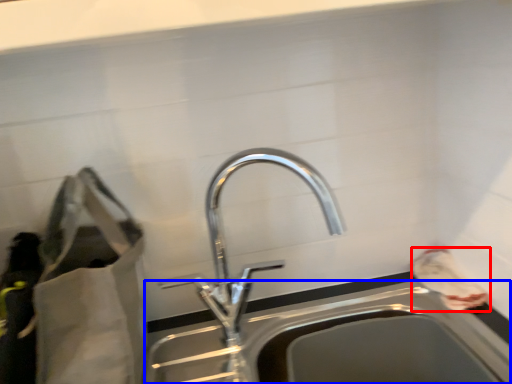
Question: Among these objects, which one is nearest to the camera, bag (highlighted by a red box) or sink (highlighted by a blue box)?

Choices:
 (A) bag
 (B) sink

Answer: (B)